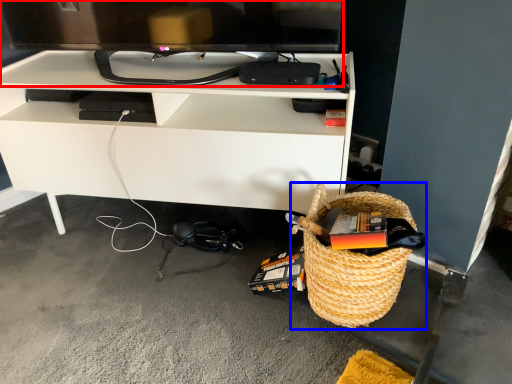
Question: Which object appears closest to the camera in this image, television (highlighted by a red box) or picnic basket (highlighted by a blue box)?

Choices:
 (A) television
 (B) picnic basket

Answer: (B)